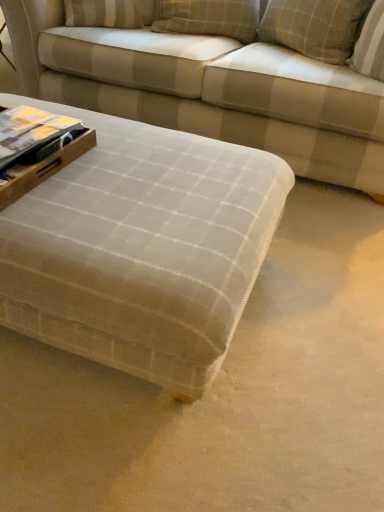
Question: Is plaid fabric pillow at upper center, the first pillow when ordered from left to right, positioned far away from textured beige fabric couch at center?

Choices:
 (A) yes
 (B) no

Answer: (B)

Question: Is textured beige fabric couch at center surrounded by plaid fabric pillow at upper center, the first pillow when ordered from left to right?

Choices:
 (A) yes
 (B) no

Answer: (B)

Question: From the image's perspective, is plaid fabric pillow at upper center, the first pillow when ordered from left to right, over textured beige fabric couch at center?

Choices:
 (A) no
 (B) yes

Answer: (B)

Question: Is plaid fabric pillow at upper center, which ranks as the second pillow in right-to-left order, positioned with its back to textured beige fabric couch at center?

Choices:
 (A) no
 (B) yes

Answer: (B)

Question: Is plaid fabric pillow at upper center, the first pillow when ordered from left to right, not inside textured beige fabric couch at center?

Choices:
 (A) no
 (B) yes

Answer: (A)

Question: From the image's perspective, is matte paper book at left positioned above or below textured beige ottoman at center?

Choices:
 (A) below
 (B) above

Answer: (B)

Question: Is point (46, 116) closer or farther from the camera than point (87, 294)?

Choices:
 (A) farther
 (B) closer

Answer: (A)

Question: In terms of size, does matte paper book at left appear bigger or smaller than textured beige ottoman at center?

Choices:
 (A) big
 (B) small

Answer: (B)

Question: Is matte paper book at left in front of or behind textured beige ottoman at center in the image?

Choices:
 (A) front
 (B) behind

Answer: (B)

Question: Based on their positions, is textured beige ottoman at center located to the left or right of plaid fabric pillow at upper center, which ranks as the second pillow in right-to-left order?

Choices:
 (A) left
 (B) right

Answer: (A)

Question: From a real-world perspective, is textured beige ottoman at center physically located above or below plaid fabric pillow at upper center, the first pillow when ordered from left to right?

Choices:
 (A) above
 (B) below

Answer: (B)

Question: Looking at their shapes, would you say textured beige ottoman at center is wider or thinner than plaid fabric pillow at upper center, which ranks as the second pillow in right-to-left order?

Choices:
 (A) wide
 (B) thin

Answer: (A)

Question: From their relative heights in the image, would you say textured beige ottoman at center is taller or shorter than plaid fabric pillow at upper center, the first pillow when ordered from left to right?

Choices:
 (A) tall
 (B) short

Answer: (A)

Question: Is textured beige fabric couch at center wider or thinner than plaid fabric pillow at upper right, positioned as the second pillow in left-to-right order?

Choices:
 (A) wide
 (B) thin

Answer: (A)

Question: From a real-world perspective, is textured beige fabric couch at center above or below plaid fabric pillow at upper right, which ranks as the first pillow in right-to-left order?

Choices:
 (A) above
 (B) below

Answer: (B)